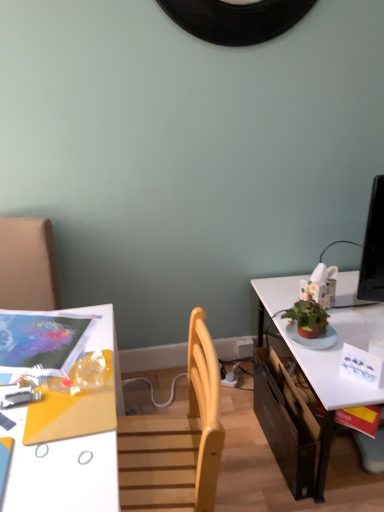
Question: Is matte plastic magazine at upper left not near black cardboard drawer at lower right?

Choices:
 (A) no
 (B) yes

Answer: (A)

Question: Considering the relative sizes of matte plastic magazine at upper left and black cardboard drawer at lower right in the image provided, is matte plastic magazine at upper left shorter than black cardboard drawer at lower right?

Choices:
 (A) no
 (B) yes

Answer: (B)

Question: From the image's perspective, does matte plastic magazine at upper left appear lower than black cardboard drawer at lower right?

Choices:
 (A) no
 (B) yes

Answer: (A)

Question: Considering the relative sizes of matte plastic magazine at upper left and black cardboard drawer at lower right in the image provided, is matte plastic magazine at upper left bigger than black cardboard drawer at lower right?

Choices:
 (A) yes
 (B) no

Answer: (B)

Question: Can you see matte plastic magazine at upper left touching black cardboard drawer at lower right?

Choices:
 (A) no
 (B) yes

Answer: (A)

Question: Do you think black cardboard drawer at lower right is within matte plastic magazine at upper left, or outside of it?

Choices:
 (A) inside
 (B) outside

Answer: (B)

Question: Considering the relative positions of black cardboard drawer at lower right and matte plastic magazine at upper left in the image provided, is black cardboard drawer at lower right to the left or to the right of matte plastic magazine at upper left?

Choices:
 (A) left
 (B) right

Answer: (B)

Question: In terms of size, does black cardboard drawer at lower right appear bigger or smaller than matte plastic magazine at upper left?

Choices:
 (A) big
 (B) small

Answer: (A)

Question: Is black cardboard drawer at lower right in front of or behind matte plastic magazine at upper left in the image?

Choices:
 (A) front
 (B) behind

Answer: (B)

Question: Considering the positions of black cardboard drawer at lower right and white glossy desk at lower left in the image, is black cardboard drawer at lower right taller or shorter than white glossy desk at lower left?

Choices:
 (A) tall
 (B) short

Answer: (B)

Question: From the image's perspective, is black cardboard drawer at lower right above or below white glossy desk at lower left?

Choices:
 (A) above
 (B) below

Answer: (A)

Question: Is black cardboard drawer at lower right situated inside white glossy desk at lower left or outside?

Choices:
 (A) inside
 (B) outside

Answer: (B)

Question: In terms of size, does black cardboard drawer at lower right appear bigger or smaller than white glossy desk at lower left?

Choices:
 (A) big
 (B) small

Answer: (B)

Question: From a real-world perspective, relative to white glossy desk at lower left, is matte plastic magazine at upper left vertically above or below?

Choices:
 (A) above
 (B) below

Answer: (A)

Question: Looking at their shapes, would you say matte plastic magazine at upper left is wider or thinner than white glossy desk at lower left?

Choices:
 (A) wide
 (B) thin

Answer: (B)